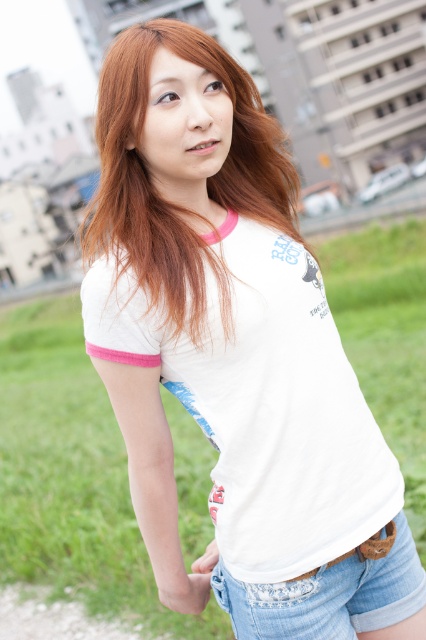
The young woman in the scene has a point marked at coordinates (206, 182). What is located at this point?

The point at coordinates (206, 182) marks blonde hair at center.

The young woman in the scene has several items of clothing and accessories. Based on the description, can you determine the spatial relationship between the blonde hair at center and the denim shorts at lower right?

The blonde hair at center is above the denim shorts at lower right.

You are a photographer trying to capture a clear shot of the blonde hair at center and denim shorts at lower right. Which object should you focus on first to ensure both are in focus?

You should focus on the blonde hair at center first since it is closer to the viewer than the denim shorts at lower right, ensuring both will be in focus when focusing on the closer object.